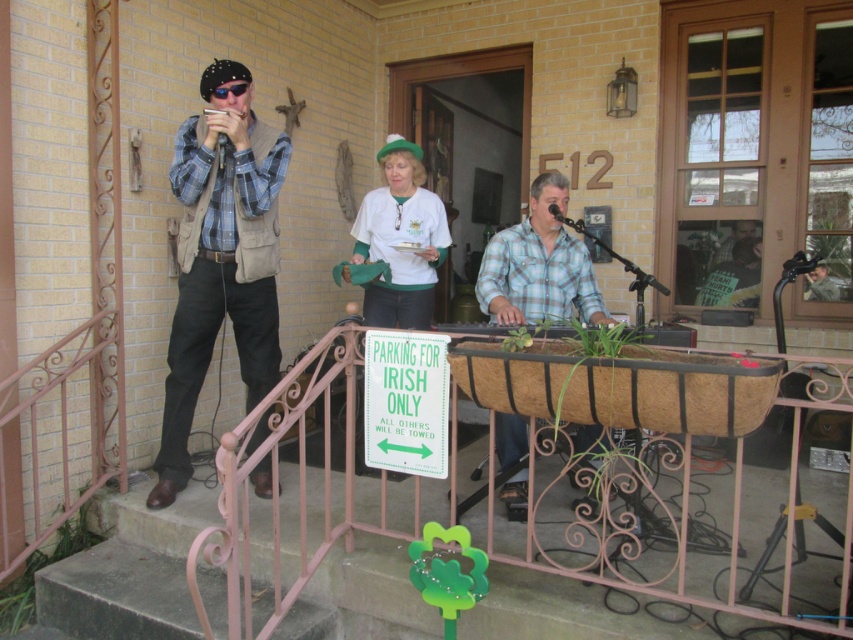
Question: Can you confirm if matte brown vest at left is positioned above white fabric hat at center?

Choices:
 (A) yes
 (B) no

Answer: (B)

Question: Is metallic pink railing at lower center wider than matte brown vest at left?

Choices:
 (A) no
 (B) yes

Answer: (B)

Question: Estimate the real-world distances between objects in this image. Which object is closer to the matte brown vest at left?

Choices:
 (A) green plastic sign at center
 (B) blue plaid shirt at center
 (C) concrete stairs at lower left

Answer: (C)

Question: Can you confirm if metallic pink railing at lower center is positioned to the right of white fabric hat at center?

Choices:
 (A) yes
 (B) no

Answer: (A)

Question: Which is nearer to the blue plaid shirt at center?

Choices:
 (A) concrete stairs at lower left
 (B) metallic pink railing at lower center
 (C) matte brown vest at left
 (D) green plastic sign at center

Answer: (D)

Question: Which point is closer to the camera taking this photo?

Choices:
 (A) (410, 227)
 (B) (241, 234)
 (C) (718, 250)
 (D) (717, 358)

Answer: (D)